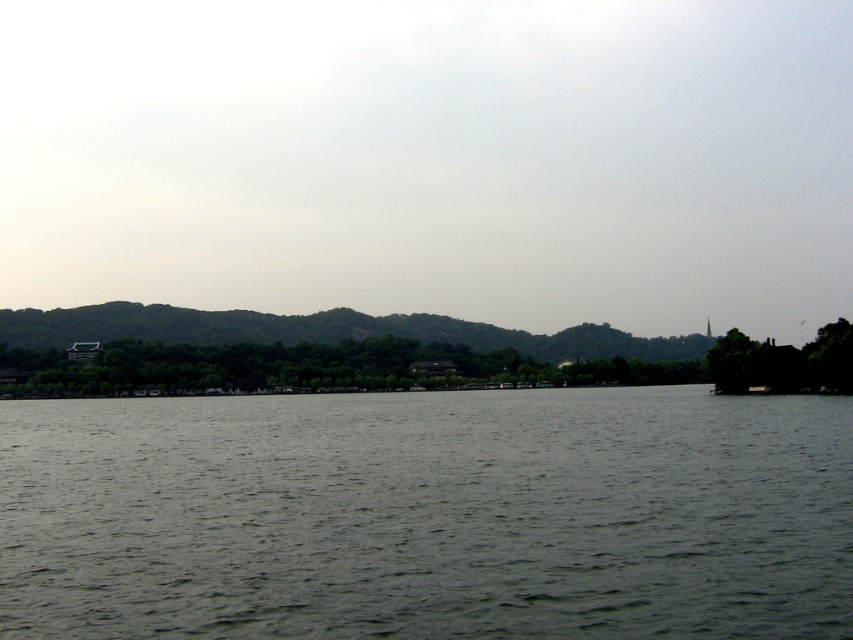
You are standing on the shore looking at the gray water at center and the green matte tree at right. Which object appears taller in the scene?

The green matte tree at right appears taller than the gray water at center.

You are standing at the edge of the gray water at center and want to walk towards the green matte tree at right. Which direction should you head?

You should head north because the gray water at center is positioned under the green matte tree at right, indicating the tree is north of the water.